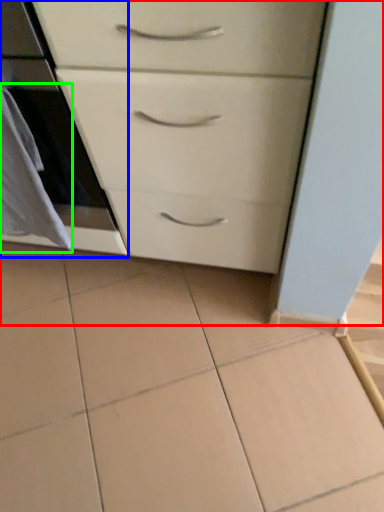
Question: Which is nearer to the chest of drawers (highlighted by a red box)? oven (highlighted by a blue box) or material (highlighted by a green box).

Choices:
 (A) oven
 (B) material

Answer: (A)